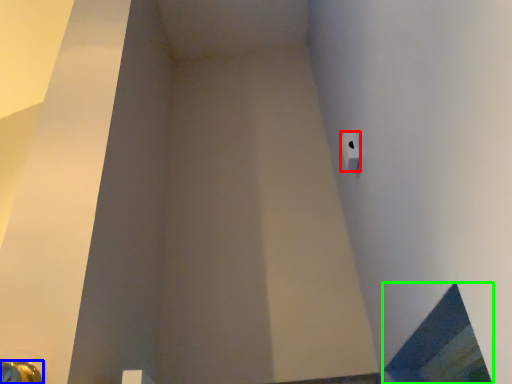
Question: Which object is positioned closest to toilet paper (highlighted by a red box)? Select from door handle (highlighted by a blue box) and window (highlighted by a green box).

Choices:
 (A) door handle
 (B) window

Answer: (B)